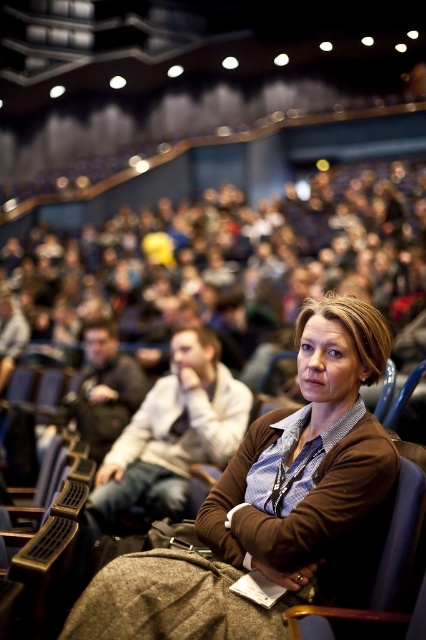
You are an event organizer and need to ensure that all attendees can see the stage. The brown fabric jacket at center and the blue fabric chair at center are in the front row. Which object is blocking the view for the attendees behind it?

The brown fabric jacket at center is much taller than the blue fabric chair at center, so it is blocking the view for the attendees behind it.

You are designing a seating chart for an event and need to place a VIP guest in a seat that is directly in front of the brown fabric jacket at center. If the auditorium uses a coordinate system where the bottom left corner is the origin point, what are the coordinates of the seat you should choose?

The coordinates of the seat directly in front of the brown fabric jacket at center would be at point (x=271, y=504), as the jacket is already positioned there.